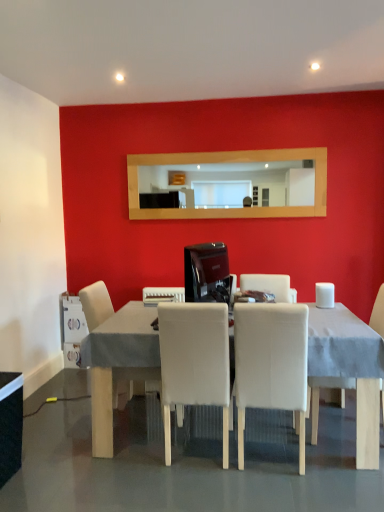
What do you see at coordinates (96, 304) in the screenshot? I see `white leather chair at center, the 4th chair viewed from the right` at bounding box center [96, 304].

Measure the distance between white leather chair at center, which ranks as the second chair in left-to-right order, and camera.

A distance of 2.24 meters exists between white leather chair at center, which ranks as the second chair in left-to-right order, and camera.

The height and width of the screenshot is (512, 384). I want to click on white leather chair at center, which appears as the 3th chair when viewed from the right, so click(194, 362).

The width and height of the screenshot is (384, 512). Find the location of `white plastic milk carton at lower left, marked as the 1th appliance in a back-to-front arrangement`. white plastic milk carton at lower left, marked as the 1th appliance in a back-to-front arrangement is located at coordinates (72, 329).

The image size is (384, 512). In order to click on matte white table at lower left, positioned as the 2th table in right-to-left order in this screenshot , I will do click(10, 424).

Locate an element on the screen. This screenshot has width=384, height=512. white leather chair at center, positioned as the first chair in left-to-right order is located at coordinates (96, 304).

Is white leather chair at center, positioned as the first chair in left-to-right order, oriented towards white leather chair at center, which appears as the 3th chair when viewed from the right?

No.

From the image's perspective, starting from the white leather chair at center, which ranks as the second chair in left-to-right order, which chair is the 1st one above? Please provide its 2D coordinates.

[(96, 304)]

Is white leather chair at center, positioned as the first chair in left-to-right order, thinner than white leather chair at center, which appears as the 3th chair when viewed from the right?

No, white leather chair at center, positioned as the first chair in left-to-right order, is not thinner than white leather chair at center, which appears as the 3th chair when viewed from the right.

How far apart are white leather chair at center, positioned as the first chair in left-to-right order, and white leather chair at center, which appears as the 3th chair when viewed from the right?

white leather chair at center, positioned as the first chair in left-to-right order, and white leather chair at center, which appears as the 3th chair when viewed from the right, are 33.13 inches apart from each other.

How distant is white plastic milk carton at lower left, which is the third appliance from top to bottom, from white fabric chair at right, which is counted as the first chair, starting from the right?

2.09 meters.

Considering the sizes of objects white plastic milk carton at lower left, placed as the third appliance when sorted from front to back, and white fabric chair at right, arranged as the 4th chair when viewed from the left, in the image provided, who is taller, white plastic milk carton at lower left, placed as the third appliance when sorted from front to back, or white fabric chair at right, arranged as the 4th chair when viewed from the left,?

Standing taller between the two is white fabric chair at right, arranged as the 4th chair when viewed from the left.

Find the location of `appliance below the white fabric chair at right, which is counted as the first chair, starting from the right (from the image's perspective)`. appliance below the white fabric chair at right, which is counted as the first chair, starting from the right (from the image's perspective) is located at coordinates pyautogui.click(x=72, y=329).

Is white plastic milk carton at lower left, placed as the third appliance when sorted from front to back, aimed at white fabric chair at right, arranged as the 4th chair when viewed from the left?

No, white plastic milk carton at lower left, placed as the third appliance when sorted from front to back, is not oriented towards white fabric chair at right, arranged as the 4th chair when viewed from the left.

The height and width of the screenshot is (512, 384). I want to click on table that is the 2nd object located below the white plastic toaster at lower center, placed as the 2th appliance when sorted from top to bottom (from the image's perspective), so click(10, 424).

Is white plastic toaster at lower center, which is the second appliance in back-to-front order, at the left side of matte white table at lower left, positioned as the 2th table in right-to-left order?

No, white plastic toaster at lower center, which is the second appliance in back-to-front order, is not to the left of matte white table at lower left, positioned as the 2th table in right-to-left order.

Considering the sizes of objects white plastic toaster at lower center, which ranks as the 2th appliance in front-to-back order, and matte white table at lower left, the first table viewed from the left, in the image provided, who is taller, white plastic toaster at lower center, which ranks as the 2th appliance in front-to-back order, or matte white table at lower left, the first table viewed from the left,?

matte white table at lower left, the first table viewed from the left, is taller.

Can you see white plastic toaster at lower center, arranged as the 2th appliance when viewed from the right, touching matte white table at lower left, the first table viewed from the left?

No, white plastic toaster at lower center, arranged as the 2th appliance when viewed from the right, is not next to matte white table at lower left, the first table viewed from the left.

From a real-world perspective, is white fabric chair at center, the 2th chair from the right, positioned over white leather chair at center, positioned as the first chair in left-to-right order, based on gravity?

No, from a real-world perspective, white fabric chair at center, the 2th chair from the right, is not above white leather chair at center, positioned as the first chair in left-to-right order.

Considering the sizes of white fabric chair at center, arranged as the third chair when viewed from the left, and white leather chair at center, positioned as the first chair in left-to-right order, in the image, is white fabric chair at center, arranged as the third chair when viewed from the left, bigger or smaller than white leather chair at center, positioned as the first chair in left-to-right order,?

In the image, white fabric chair at center, arranged as the third chair when viewed from the left, appears to be smaller than white leather chair at center, positioned as the first chair in left-to-right order.

Does white fabric chair at center, the 2th chair from the right, turn towards white leather chair at center, the 4th chair viewed from the right?

No, white fabric chair at center, the 2th chair from the right, is not facing towards white leather chair at center, the 4th chair viewed from the right.

Is white fabric chair at center, arranged as the third chair when viewed from the left, situated inside white leather chair at center, positioned as the first chair in left-to-right order, or outside?

white fabric chair at center, arranged as the third chair when viewed from the left, cannot be found inside white leather chair at center, positioned as the first chair in left-to-right order.

Considering the sizes of objects glossy black coffee machine at center, acting as the first appliance starting from the right, and white fabric table at center, which is the 1th table from right to left, in the image provided, who is taller, glossy black coffee machine at center, acting as the first appliance starting from the right, or white fabric table at center, which is the 1th table from right to left,?

With more height is white fabric table at center, which is the 1th table from right to left.

From the image's perspective, is glossy black coffee machine at center, which is the first appliance from front to back, located above or below white fabric table at center, which is the 1th table from right to left?

From the image's perspective, glossy black coffee machine at center, which is the first appliance from front to back, appears above white fabric table at center, which is the 1th table from right to left.

Can you tell me how much glossy black coffee machine at center, which is the first appliance from front to back, and white fabric table at center, which is the 1th table from right to left, differ in facing direction?

The angle between the facing direction of glossy black coffee machine at center, which is the first appliance from front to back, and the facing direction of white fabric table at center, which is the 1th table from right to left, is 166 degrees.

From a real-world perspective, which is physically below, glossy black coffee machine at center, arranged as the third appliance when ordered from the bottom, or white fabric table at center, placed as the 2th table when sorted from left to right?

white fabric table at center, placed as the 2th table when sorted from left to right, from a real-world perspective.

Is matte white table at lower left, the first table viewed from the left, surrounding white plastic milk carton at lower left, the 1th appliance when ordered from bottom to top?

No.

Where is `the 2nd table below the white plastic milk carton at lower left, the 3th appliance positioned from the right (from the image's perspective)`? The image size is (384, 512). the 2nd table below the white plastic milk carton at lower left, the 3th appliance positioned from the right (from the image's perspective) is located at coordinates (10, 424).

Are matte white table at lower left, the first table viewed from the left, and white plastic milk carton at lower left, placed as the third appliance when sorted from front to back, making contact?

No, matte white table at lower left, the first table viewed from the left, is not touching white plastic milk carton at lower left, placed as the third appliance when sorted from front to back.

Looking at the image, does matte white table at lower left, positioned as the 2th table in right-to-left order, seem bigger or smaller compared to white plastic milk carton at lower left, the 1th appliance when ordered from bottom to top?

matte white table at lower left, positioned as the 2th table in right-to-left order, is smaller than white plastic milk carton at lower left, the 1th appliance when ordered from bottom to top.

Considering the relative sizes of white fabric chair at right, which is counted as the first chair, starting from the right, and white plastic toaster at lower center, which is the second appliance in back-to-front order, in the image provided, is white fabric chair at right, which is counted as the first chair, starting from the right, smaller than white plastic toaster at lower center, which is the second appliance in back-to-front order,?

Actually, white fabric chair at right, which is counted as the first chair, starting from the right, might be larger than white plastic toaster at lower center, which is the second appliance in back-to-front order.

From a real-world perspective, is white fabric chair at right, arranged as the 4th chair when viewed from the left, physically located above or below white plastic toaster at lower center, arranged as the 2th appliance when viewed from the right?

In terms of real-world spatial position, white fabric chair at right, arranged as the 4th chair when viewed from the left, is below white plastic toaster at lower center, arranged as the 2th appliance when viewed from the right.

At what (x,y) coordinates should I click in order to perform the action: click on the 2nd chair in front of the white leather chair at center, positioned as the first chair in left-to-right order, counting from the anchor's position. Please return your answer as a coordinate pair (x, y). Looking at the image, I should click on (194, 362).

Identify the location of appliance that is the 3rd object to the left of the white fabric chair at right, arranged as the 4th chair when viewed from the left, starting at the anchor. This screenshot has height=512, width=384. (72, 329).

When comparing their distances from white leather chair at center, positioned as the first chair in left-to-right order, does white plastic milk carton at lower left, marked as the 1th appliance in a back-to-front arrangement, or white fabric table at center, which is the 1th table from right to left, seem further?

white plastic milk carton at lower left, marked as the 1th appliance in a back-to-front arrangement, is further to white leather chair at center, positioned as the first chair in left-to-right order.

From the picture: From the image, which object appears to be nearer to white plastic toaster at lower center, placed as the 2th appliance when sorted from top to bottom, white fabric chair at center, the 2th chair from the right, or white fabric table at center, placed as the 2th table when sorted from left to right?

Based on the image, white fabric table at center, placed as the 2th table when sorted from left to right, appears to be nearer to white plastic toaster at lower center, placed as the 2th appliance when sorted from top to bottom.

Based on their spatial positions, is white leather chair at center, positioned as the first chair in left-to-right order, or white fabric chair at center, the 2th chair from the right, further from wooden mirror at upper center?

white fabric chair at center, the 2th chair from the right, lies further to wooden mirror at upper center than the other object.

Which object lies further to the anchor point white plastic toaster at lower center, which is the second appliance in back-to-front order, white fabric chair at center, the 2th chair from the right, or matte white table at lower left, the first table viewed from the left?

Among the two, matte white table at lower left, the first table viewed from the left, is located further to white plastic toaster at lower center, which is the second appliance in back-to-front order.

Looking at this image, estimate the real-world distances between objects in this image. Which object is further from matte white table at lower left, the first table viewed from the left, white leather chair at center, the 4th chair viewed from the right, or white plastic milk carton at lower left, placed as the third appliance when sorted from front to back?

white plastic milk carton at lower left, placed as the third appliance when sorted from front to back.

Estimate the real-world distances between objects in this image. Which object is closer to matte white table at lower left, positioned as the 2th table in right-to-left order, white plastic milk carton at lower left, the 1th appliance when ordered from bottom to top, or white leather chair at center, which ranks as the second chair in left-to-right order?

white leather chair at center, which ranks as the second chair in left-to-right order, lies closer to matte white table at lower left, positioned as the 2th table in right-to-left order, than the other object.

Based on their spatial positions, is white leather chair at center, the 4th chair viewed from the right, or white leather chair at center, which appears as the 3th chair when viewed from the right, closer to white fabric chair at right, arranged as the 4th chair when viewed from the left?

Among the two, white leather chair at center, which appears as the 3th chair when viewed from the right, is located nearer to white fabric chair at right, arranged as the 4th chair when viewed from the left.

Which object lies nearer to the anchor point matte white table at lower left, positioned as the 2th table in right-to-left order, white plastic milk carton at lower left, which is the third appliance from top to bottom, or white plastic toaster at lower center, arranged as the 2th appliance when viewed from the right?

white plastic toaster at lower center, arranged as the 2th appliance when viewed from the right, is positioned closer to the anchor matte white table at lower left, positioned as the 2th table in right-to-left order.

I want to click on mirror located between white plastic milk carton at lower left, the 1th appliance when ordered from bottom to top, and white fabric chair at right, arranged as the 4th chair when viewed from the left, in the left-right direction, so click(x=234, y=183).

In order to click on appliance located between white leather chair at center, which ranks as the second chair in left-to-right order, and white plastic toaster at lower center, which ranks as the 2th appliance in left-to-right order, in the depth direction in this screenshot , I will do `click(207, 273)`.

I want to click on mirror positioned between glossy black coffee machine at center, which is the first appliance from front to back, and white plastic milk carton at lower left, which is the first appliance in left-to-right order, from near to far, so click(x=234, y=183).

At what (x,y) coordinates should I click in order to perform the action: click on table located between matte white table at lower left, positioned as the 2th table in right-to-left order, and white fabric chair at right, arranged as the 4th chair when viewed from the left, in the left-right direction. Please return your answer as a coordinate pair (x, y). Image resolution: width=384 pixels, height=512 pixels. Looking at the image, I should click on (118, 364).